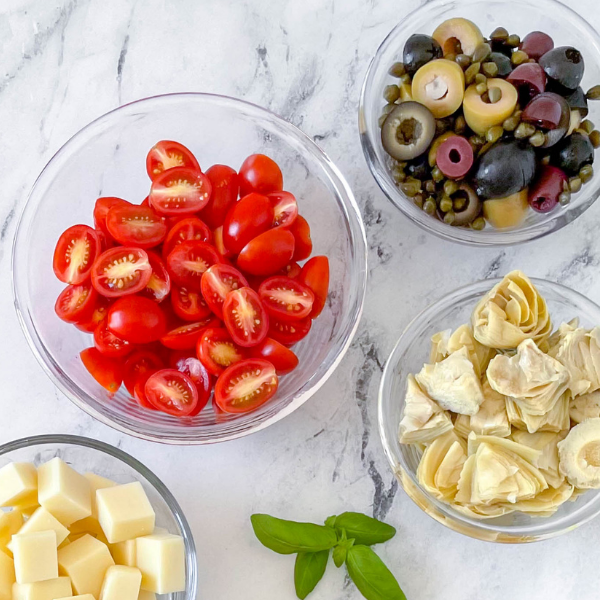
You are a GUI agent. You are given a task and a screenshot of the screen. Output one action in this format:
    pyautogui.click(x=<x>, y=<y>)
    Task: Click on the bowl
    This screenshot has height=600, width=600.
    Given the screenshot: What is the action you would take?
    coord(455,524)